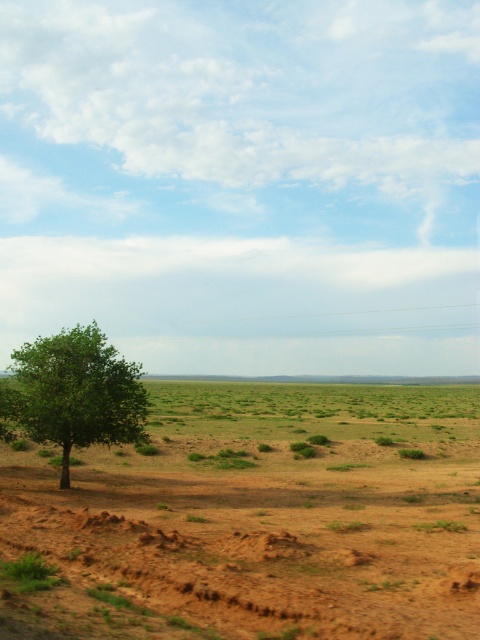
Who is shorter, brown sandy dirt field at lower left or green leafy tree at left?

green leafy tree at left

Which is below, brown sandy dirt field at lower left or green leafy tree at left?

brown sandy dirt field at lower left is lower down.

The width and height of the screenshot is (480, 640). Find the location of `brown sandy dirt field at lower left`. brown sandy dirt field at lower left is located at coordinates (253, 518).